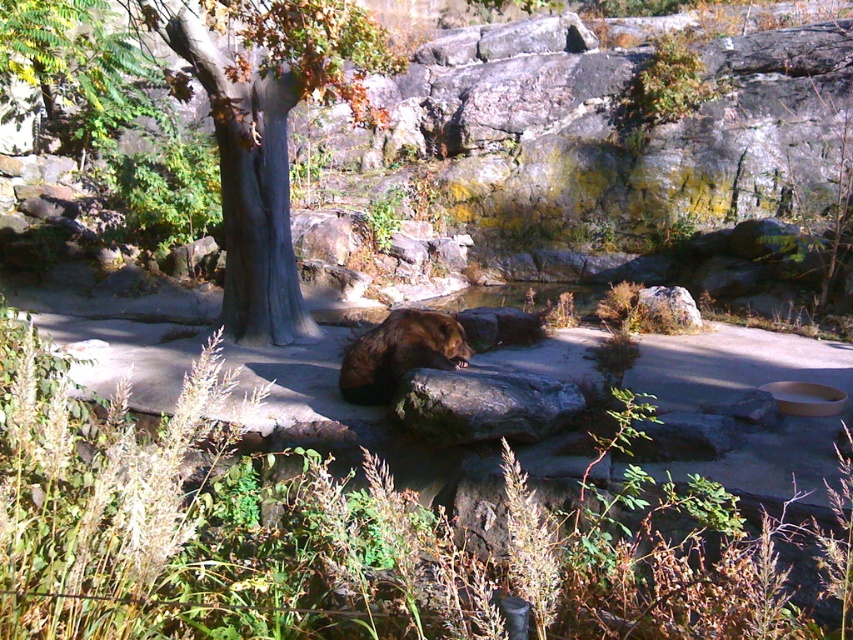
Question: Which is farther from the brown wood tree at center?

Choices:
 (A) gray rough rock at center
 (B) brown furry bear at center

Answer: (A)

Question: Which of the following is the farthest from the observer?

Choices:
 (A) gray rough rock at center
 (B) brown wood tree at center

Answer: (B)

Question: Does brown wood tree at center appear under brown furry bear at center?

Choices:
 (A) yes
 (B) no

Answer: (B)

Question: Can you confirm if brown wood tree at center is smaller than gray rough rock at center?

Choices:
 (A) no
 (B) yes

Answer: (A)

Question: Where is brown wood tree at center located in relation to brown furry bear at center in the image?

Choices:
 (A) right
 (B) left

Answer: (B)

Question: Which of the following is the farthest from the observer?

Choices:
 (A) gray rough rock at center
 (B) brown furry bear at center
 (C) brown wood tree at center

Answer: (C)